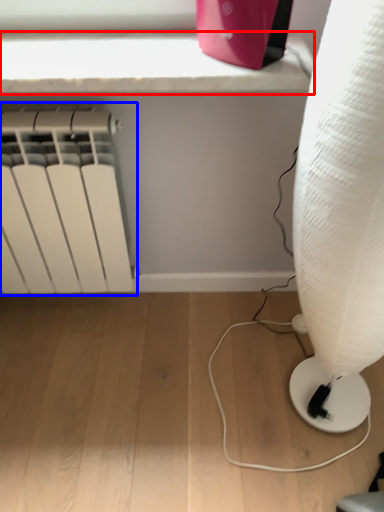
Question: Which of the following is the closest to the observer, window sill (highlighted by a red box) or radiator (highlighted by a blue box)?

Choices:
 (A) window sill
 (B) radiator

Answer: (A)